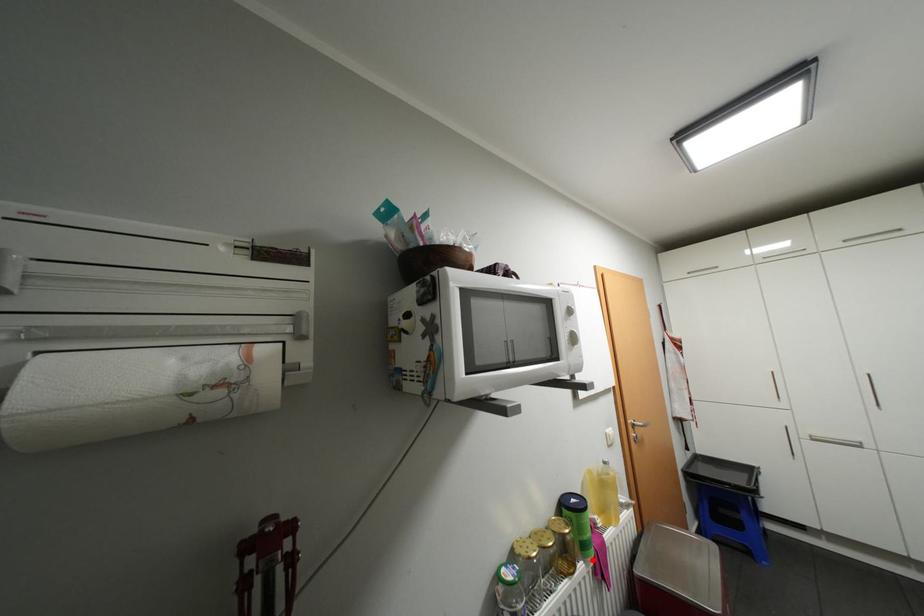
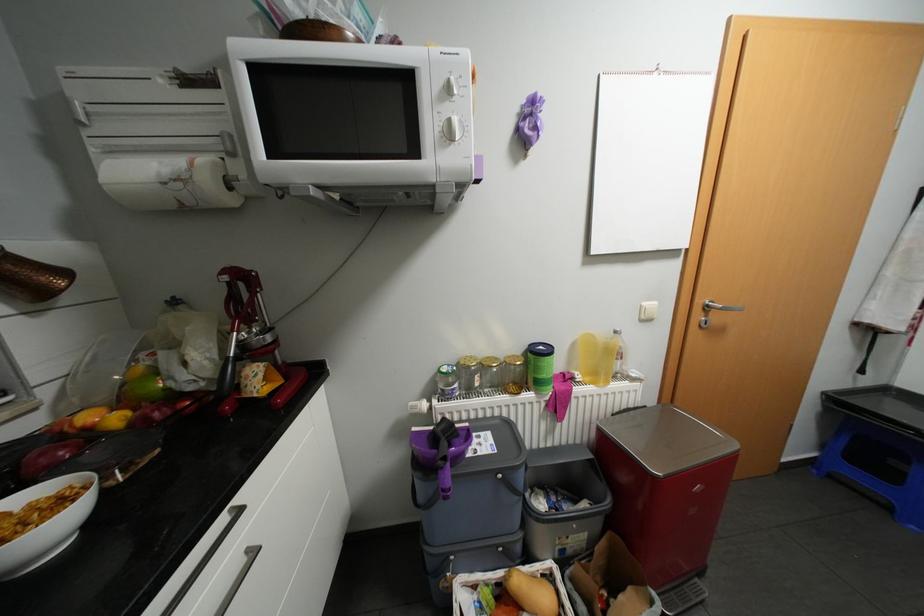
Where in the second image is the point corresponding to the highlighted location from the first image?

(544, 392)